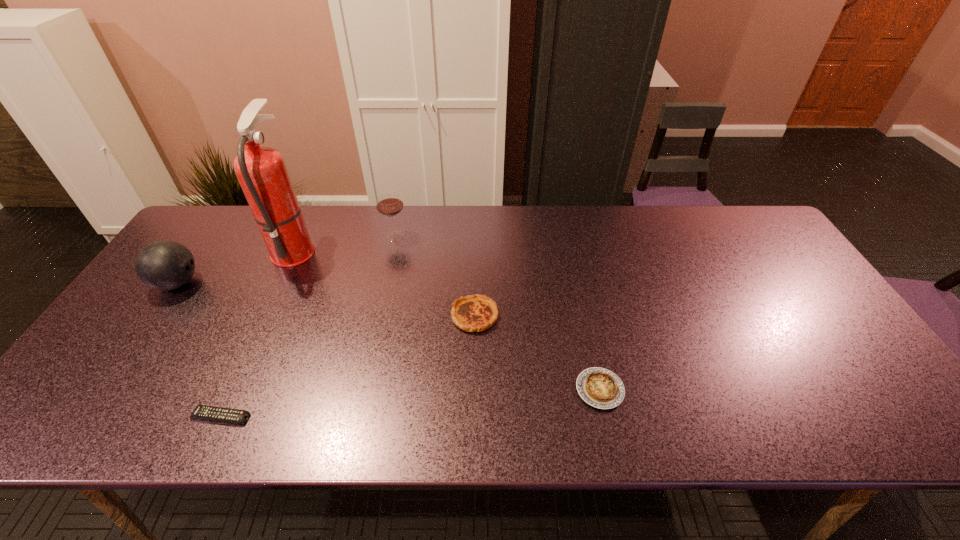
This screenshot has width=960, height=540. I want to click on free spot located 0.180m on the grip area of the bowling ball, so click(x=265, y=283).

This screenshot has width=960, height=540. I want to click on free spot located 0.210m on the back of the left quiche, so click(475, 249).

You are a GUI agent. You are given a task and a screenshot of the screen. Output one action in this format:
    pyautogui.click(x=<x>, y=<y>)
    Task: Click on the vacant space located 0.270m on the back of the shorter quiche
    The image size is (960, 540).
    Given the screenshot: What is the action you would take?
    pyautogui.click(x=577, y=288)

The image size is (960, 540). I want to click on free region located on the left of the shortest object, so click(x=90, y=416).

In order to click on fire extinguisher present at the far edge in this screenshot , I will do `click(262, 173)`.

The image size is (960, 540). Identify the location of wineglass situated at the far edge. tap(389, 203).

This screenshot has width=960, height=540. In order to click on quiche present at the near edge in this screenshot , I will do `click(601, 388)`.

The width and height of the screenshot is (960, 540). I want to click on remote control present at the near edge, so click(x=214, y=413).

Locate an element on the screen. The image size is (960, 540). object present at the left edge is located at coordinates (163, 265).

What are the coordinates of `free space at the far edge of the desktop` in the screenshot? It's located at 346,226.